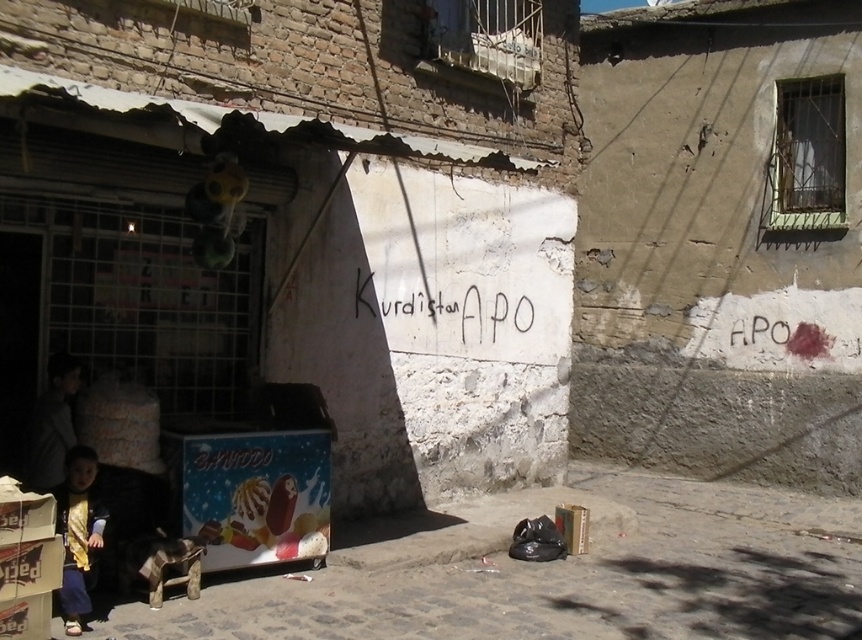
You are a delivery person standing at the entrance of the brick building. You need to place a package on the cardboard ice cream stand at lower left and then pick up the dark gray jacket at lower left. Which object should you interact with first based on their positions?

You should interact with the cardboard ice cream stand at lower left first because it is closer to you than the dark gray jacket at lower left, which is further away.

You are standing in the urban street scene described. There is a point at coordinates point (648, 548). If you want to throw a small ball to hit that point, will it land on the weathered brick building or the concrete wall?

The point (648, 548) is 7.08 meters from the viewer. Since the concrete wall is on the right side of the image and the point is likely located there, the ball will land on the concrete wall.

You are a delivery person trying to find the Kurdistan. You see a cardboard ice cream stand at lower left and a brick building with a corrugated metal awning on the left. Based on the coordinates provided, which object is closer to the point marked at (569,580)?

The cardboard ice cream stand at lower left is located at point (569,580), so it is exactly at that coordinate and therefore the closest object to that point.